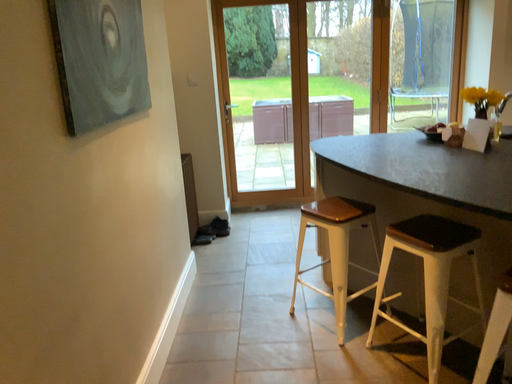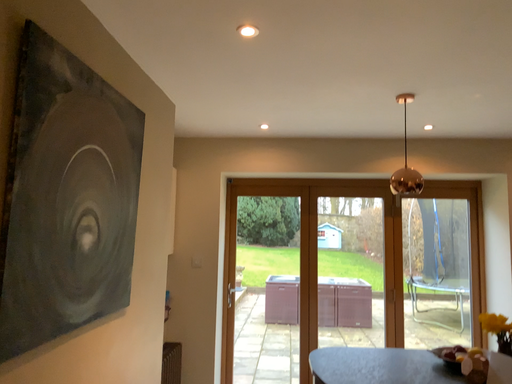
Question: Which way did the camera rotate in the video?

Choices:
 (A) rotated downward
 (B) rotated upward

Answer: (B)